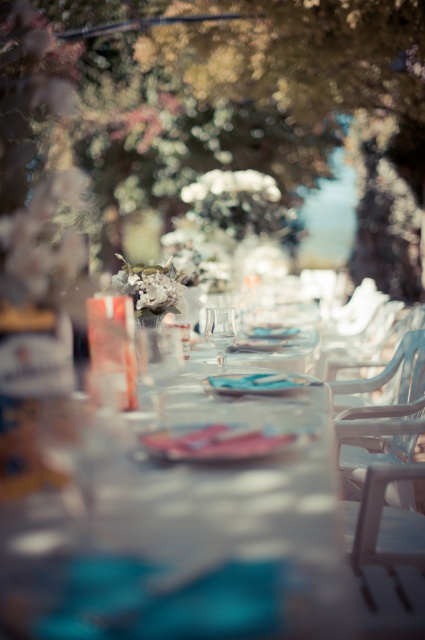
Is white glossy table at center to the right of white plastic chair at center from the viewer's perspective?

No, white glossy table at center is not to the right of white plastic chair at center.

Between point (263, 419) and point (402, 589), which one is positioned in front?

Point (402, 589)

The width and height of the screenshot is (425, 640). In order to click on white glossy table at center in this screenshot , I will do `click(161, 508)`.

At what (x,y) coordinates should I click in order to perform the action: click on white glossy table at center. Please return your answer as a coordinate pair (x, y). The height and width of the screenshot is (640, 425). Looking at the image, I should click on (161, 508).

Is point (159, 337) less distant than point (204, 330)?

Yes, point (159, 337) is closer to viewer.

Who is more forward, (147,330) or (221,308)?

Point (147,330)

Find the location of a particular element. clear glass wine glass at center is located at coordinates (158, 362).

In the scene shown: Who is more distant from viewer, (136,486) or (254,390)?

Positioned behind is point (254,390).

Who is more distant from viewer, (x=323, y=556) or (x=229, y=380)?

Point (x=229, y=380)

You are a GUI agent. You are given a task and a screenshot of the screen. Output one action in this format:
    pyautogui.click(x=<x>, y=<y>)
    Task: Click on the white glossy table at center
    Image resolution: width=425 pixels, height=640 pixels.
    Given the screenshot: What is the action you would take?
    pyautogui.click(x=161, y=508)